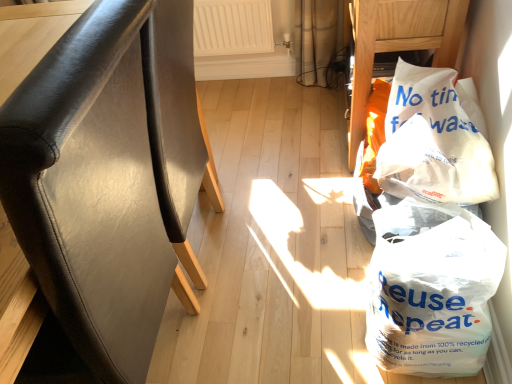
Question: Does white plastic bag at lower right, marked as the 1th plastic bag in a bottom-to-top arrangement, have a smaller size compared to white paper bag at right, which is the 2th plastic bag in bottom-to-top order?

Choices:
 (A) yes
 (B) no

Answer: (B)

Question: Is white paper bag at right, which is the 2th plastic bag in bottom-to-top order, located within white plastic bag at lower right, the 2th plastic bag when ordered from top to bottom?

Choices:
 (A) no
 (B) yes

Answer: (A)

Question: Can you confirm if white plastic bag at lower right, the 2th plastic bag when ordered from top to bottom, is bigger than white paper bag at right, which is the 2th plastic bag in bottom-to-top order?

Choices:
 (A) yes
 (B) no

Answer: (A)

Question: Could you tell me if white plastic bag at lower right, marked as the 1th plastic bag in a bottom-to-top arrangement, is turned towards white paper bag at right, which appears as the first plastic bag when viewed from the top?

Choices:
 (A) no
 (B) yes

Answer: (A)

Question: Can you confirm if white plastic bag at lower right, the 2th plastic bag when ordered from top to bottom, is positioned to the right of white paper bag at right, which is the 2th plastic bag in bottom-to-top order?

Choices:
 (A) yes
 (B) no

Answer: (B)

Question: Is black leather chair at left, which appears as the first furniture when ordered from the bottom, wider or thinner than white paper bag at right, which appears as the first plastic bag when viewed from the top?

Choices:
 (A) wide
 (B) thin

Answer: (A)

Question: From their relative heights in the image, would you say black leather chair at left, the 1th furniture from the left, is taller or shorter than white paper bag at right, which is the 2th plastic bag in bottom-to-top order?

Choices:
 (A) tall
 (B) short

Answer: (A)

Question: Considering the positions of point (138, 261) and point (426, 84), is point (138, 261) closer or farther from the camera than point (426, 84)?

Choices:
 (A) closer
 (B) farther

Answer: (A)

Question: Would you say black leather chair at left, the 2th furniture viewed from the top, is inside or outside white paper bag at right, which is the 2th plastic bag in bottom-to-top order?

Choices:
 (A) inside
 (B) outside

Answer: (B)

Question: Is white plastic bag at lower right, the 2th plastic bag when ordered from top to bottom, in front of or behind white paper bag at upper right, the 1th furniture in the right-to-left sequence, in the image?

Choices:
 (A) front
 (B) behind

Answer: (A)

Question: Is white plastic bag at lower right, marked as the 1th plastic bag in a bottom-to-top arrangement, wider or thinner than white paper bag at upper right, placed as the 1th furniture when sorted from back to front?

Choices:
 (A) thin
 (B) wide

Answer: (A)

Question: From the image's perspective, is white plastic bag at lower right, marked as the 1th plastic bag in a bottom-to-top arrangement, positioned above or below white paper bag at upper right, which is the second furniture in front-to-back order?

Choices:
 (A) above
 (B) below

Answer: (B)

Question: Does point (397, 289) appear closer or farther from the camera than point (451, 43)?

Choices:
 (A) farther
 (B) closer

Answer: (B)

Question: From their relative heights in the image, would you say white plastic bag at lower right, the 2th plastic bag when ordered from top to bottom, is taller or shorter than white paper bag at right, which appears as the first plastic bag when viewed from the top?

Choices:
 (A) tall
 (B) short

Answer: (A)

Question: In terms of size, does white plastic bag at lower right, marked as the 1th plastic bag in a bottom-to-top arrangement, appear bigger or smaller than white paper bag at right, which is the 2th plastic bag in bottom-to-top order?

Choices:
 (A) small
 (B) big

Answer: (B)